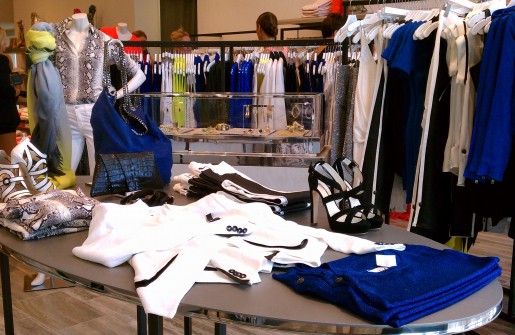
This screenshot has height=335, width=515. In order to click on yellow wall in this screenshot , I will do `click(62, 10)`, `click(7, 8)`.